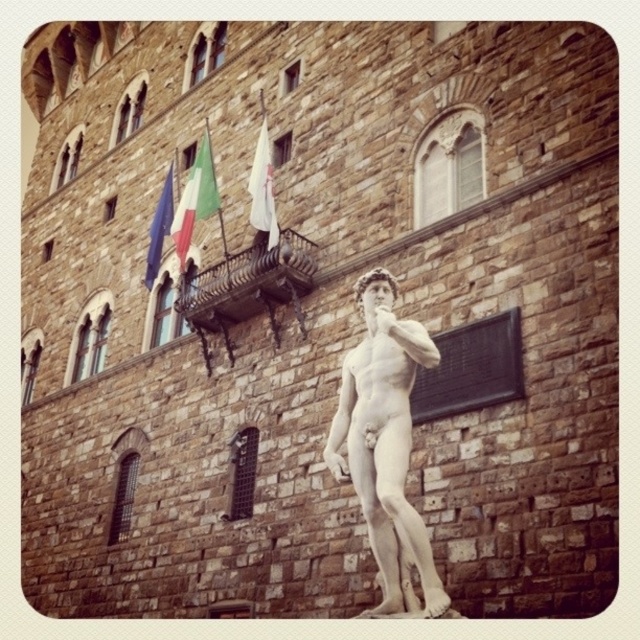
You are an art student standing in front of the historic stone building. You notice the white marble statue at center and the blue fabric flag at upper left. Which object is positioned higher in the image?

The blue fabric flag at upper left is positioned higher than the white marble statue at center.

You are an art student visiting the statue of David. You notice two flags above the balcony in the background. Which flag is taller, the white fabric flag at upper center or the blue fabric flag at upper left?

The white fabric flag at upper center is much taller than the blue fabric flag at upper left.

You are standing 50 meters away from the historic stone building. You see the green fabric flag at upper center. Can you reach the flag without moving closer than your current position?

The green fabric flag at upper center is 48.41 meters away from the viewer. Since you are currently 50 meters away from the historic stone building, you are farther than the flag. Therefore, you cannot reach the flag without moving closer.